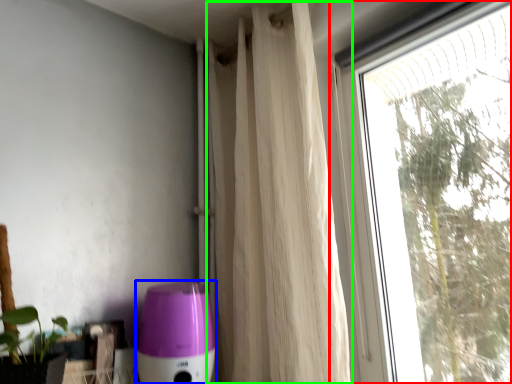
Question: Based on their relative distances, which object is farther from window (highlighted by a red box)? Choose from appliance (highlighted by a blue box) and curtain (highlighted by a green box).

Choices:
 (A) appliance
 (B) curtain

Answer: (A)